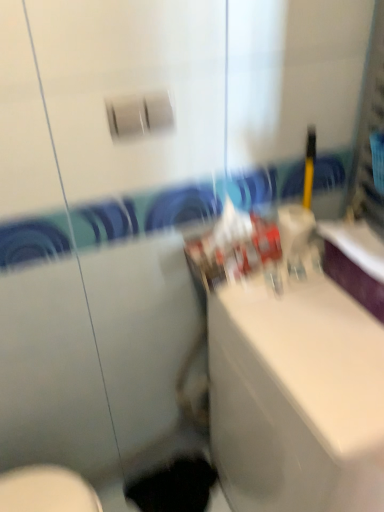
You are a GUI agent. You are given a task and a screenshot of the screen. Output one action in this format:
    pyautogui.click(x=<x>, y=<y>)
    Task: Click on the black matte hole at lower center
    The image size is (384, 512).
    Given the screenshot: What is the action you would take?
    pyautogui.click(x=174, y=486)

Measure the distance between black matte hole at lower center and camera.

4.68 feet.

Measure the distance between point (203, 480) and camera.

Point (203, 480) is 4.92 feet away from camera.

What do you see at coordinates (174, 486) in the screenshot?
I see `black matte hole at lower center` at bounding box center [174, 486].

This screenshot has width=384, height=512. What are the coordinates of `white glossy sink at center` in the screenshot? It's located at (295, 392).

The width and height of the screenshot is (384, 512). What do you see at coordinates (295, 392) in the screenshot?
I see `white glossy sink at center` at bounding box center [295, 392].

What are the coordinates of `black matte hole at lower center` in the screenshot? It's located at (174, 486).

Which object is positioned more to the left, black matte hole at lower center or white glossy sink at center?

black matte hole at lower center is more to the left.

Between black matte hole at lower center and white glossy sink at center, which one is positioned behind?

black matte hole at lower center is further away from the camera.

Between point (143, 501) and point (321, 328), which one is positioned behind?

The point (143, 501) is farther from the camera.

Based on the photo, from the image's perspective, would you say black matte hole at lower center is shown under white glossy sink at center?

Correct, black matte hole at lower center appears lower than white glossy sink at center in the image.

From a real-world perspective, does black matte hole at lower center stand above white glossy sink at center?

Actually, black matte hole at lower center is physically below white glossy sink at center in the real world.

Between black matte hole at lower center and white glossy sink at center, which one has larger width?

With larger width is white glossy sink at center.

Does black matte hole at lower center have a lesser height compared to white glossy sink at center?

Yes.

Is black matte hole at lower center smaller than white glossy sink at center?

Yes.

Would you say black matte hole at lower center is outside white glossy sink at center?

Yes.

Are black matte hole at lower center and white glossy sink at center beside each other?

No, black matte hole at lower center is not making contact with white glossy sink at center.

Is black matte hole at lower center facing away from white glossy sink at center?

That's not correct — black matte hole at lower center is not looking away from white glossy sink at center.

Locate an element on the screen. hole lying behind the white glossy sink at center is located at coordinates (174, 486).

Based on their positions, is white glossy sink at center located to the left or right of black matte hole at lower center?

In the image, white glossy sink at center appears on the right side of black matte hole at lower center.

In the image, is white glossy sink at center positioned in front of or behind black matte hole at lower center?

Visually, white glossy sink at center is located in front of black matte hole at lower center.

Does point (217, 349) come closer to viewer compared to point (149, 479)?

Yes, it is.

Consider the image. From the image's perspective, which object appears higher, white glossy sink at center or black matte hole at lower center?

white glossy sink at center, from the image's perspective.

From a real-world perspective, between white glossy sink at center and black matte hole at lower center, who is vertically higher?

In real-world perspective, white glossy sink at center is above.

Is white glossy sink at center thinner than black matte hole at lower center?

Incorrect, the width of white glossy sink at center is not less than that of black matte hole at lower center.

Based on the photo, is white glossy sink at center taller than black matte hole at lower center?

Indeed, white glossy sink at center has a greater height compared to black matte hole at lower center.

Is white glossy sink at center bigger or smaller than black matte hole at lower center?

Considering their sizes, white glossy sink at center takes up more space than black matte hole at lower center.

Would you say white glossy sink at center contains black matte hole at lower center?

No, black matte hole at lower center is located outside of white glossy sink at center.

Is white glossy sink at center with black matte hole at lower center?

No, white glossy sink at center is not with black matte hole at lower center.

Is white glossy sink at center oriented towards black matte hole at lower center?

No.

This screenshot has height=512, width=384. In the image, there is a black matte hole at lower center. Find the location of `counter top above it (from the image's perspective)`. counter top above it (from the image's perspective) is located at coordinates (295, 392).

The image size is (384, 512). I want to click on counter top on the right side of black matte hole at lower center, so click(295, 392).

This screenshot has height=512, width=384. What are the coordinates of `counter top in front of the black matte hole at lower center` in the screenshot? It's located at (295, 392).